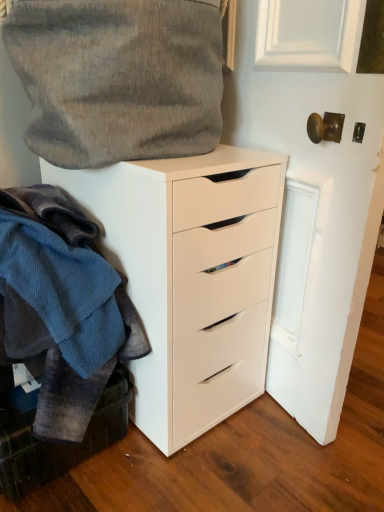
Question: Does point (112, 432) appear closer or farther from the camera than point (155, 142)?

Choices:
 (A) closer
 (B) farther

Answer: (B)

Question: From their relative heights in the image, would you say white matte cabinet at lower left is taller or shorter than textured gray fabric at upper left?

Choices:
 (A) tall
 (B) short

Answer: (B)

Question: Estimate the real-world distances between objects in this image. Which object is farther from the knitted wool sweater at left?

Choices:
 (A) white matte cabinet at lower left
 (B) textured gray fabric at upper left
 (C) white matte chest of drawers at center

Answer: (B)

Question: Which of these objects is positioned closest to the white matte chest of drawers at center?

Choices:
 (A) white matte cabinet at lower left
 (B) textured gray fabric at upper left
 (C) knitted wool sweater at left

Answer: (C)